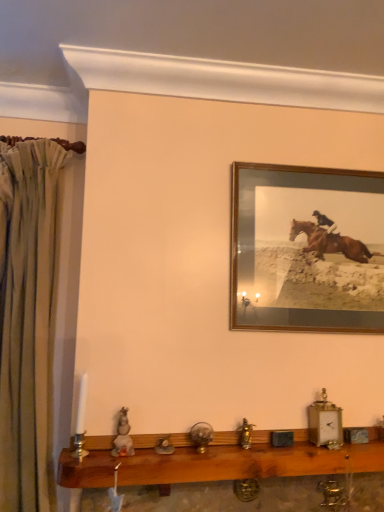
Question: Based on their sizes in the image, would you say wooden shelf at lower center is bigger or smaller than wooden frame at upper right?

Choices:
 (A) big
 (B) small

Answer: (A)

Question: Considering their positions, is wooden shelf at lower center located in front of or behind wooden frame at upper right?

Choices:
 (A) front
 (B) behind

Answer: (A)

Question: Considering the real-world distances, which object is closest to the wooden shelf at lower center?

Choices:
 (A) beige fabric curtain at left
 (B) wooden frame at upper right

Answer: (A)

Question: Estimate the real-world distances between objects in this image. Which object is closer to the wooden frame at upper right?

Choices:
 (A) wooden shelf at lower center
 (B) beige fabric curtain at left

Answer: (A)